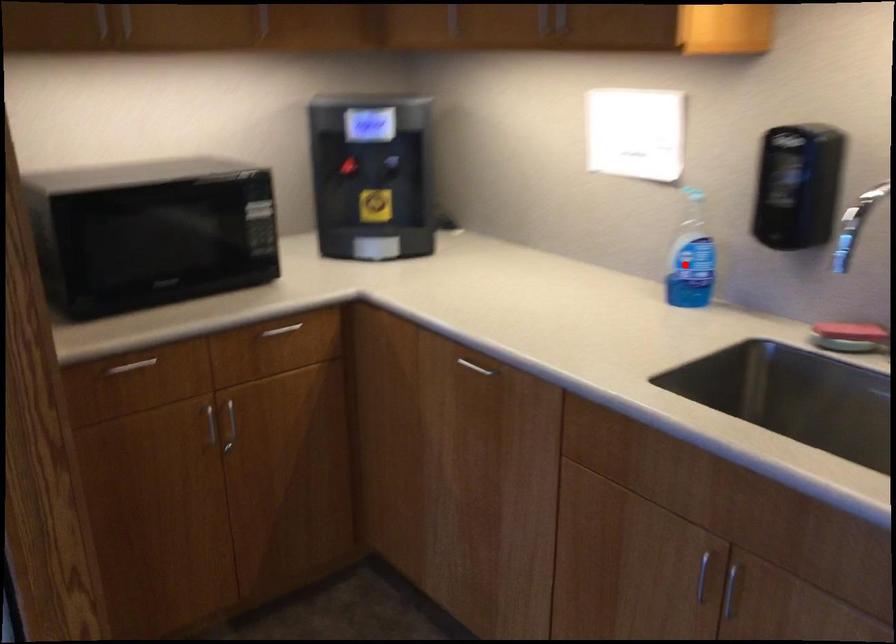
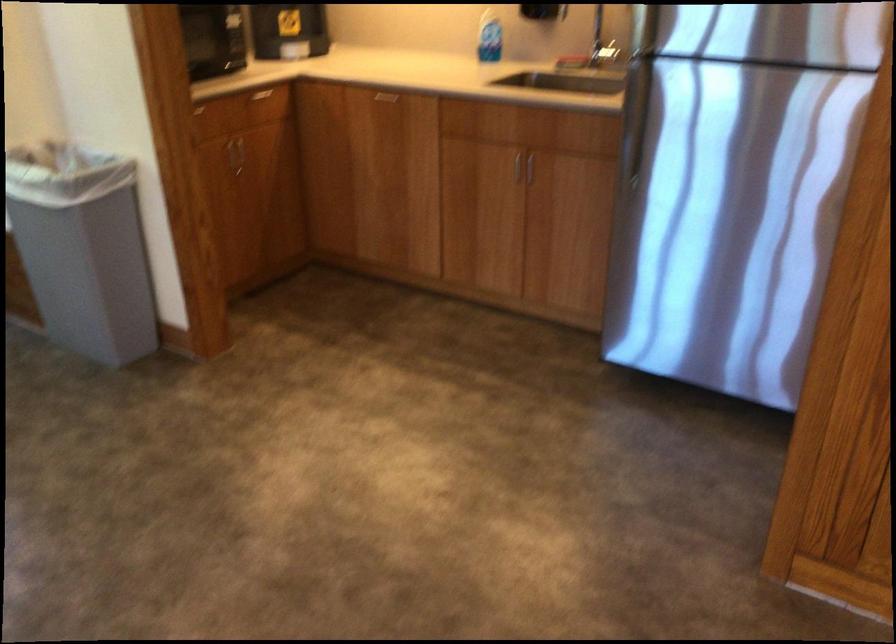
Question: I am providing you with two images of the same scene from different viewpoints. A red point is shown in image1. For the corresponding object point in image2, is it positioned nearer or farther from the camera?

Choices:
 (A) Nearer
 (B) Farther

Answer: (B)